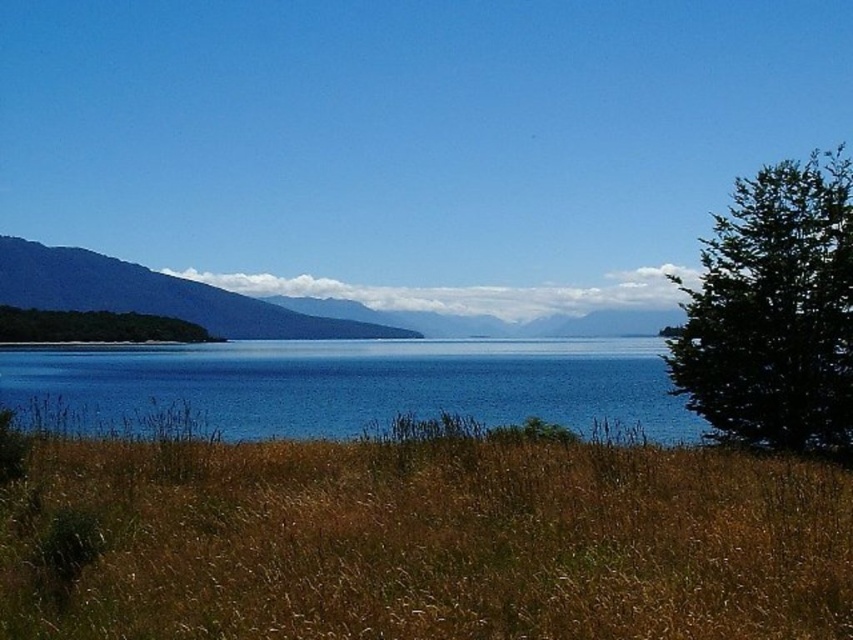
You are standing at the point labeled as point (422, 540) in the image. Which terrain feature are you currently standing on?

You are standing on the brown dry grass at lower center.

You are standing at the center of the image and want to step onto the calm, deep blue water in the middle ground. To avoid stepping on the brown dry grass at lower center, which is in your path, should you move slightly to your left or right?

The brown dry grass at lower center is located at point (x=422, y=540), so you should move slightly to your left to avoid stepping on it.

You are standing at the edge of the field and want to walk towards the blue water at center. Which direction should you walk relative to the brown dry grass at lower center?

You should walk to the left of the brown dry grass at lower center because the blue water at center is to the left of the brown dry grass at lower center.